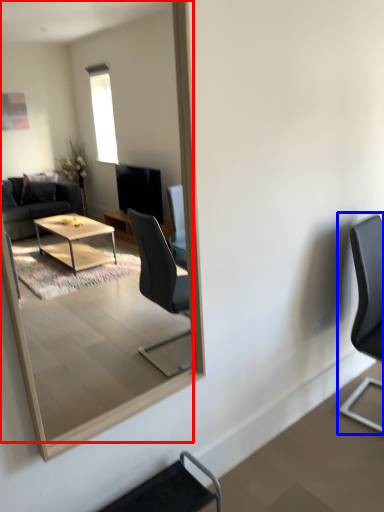
Question: Among these objects, which one is farthest to the camera, mirror (highlighted by a red box) or chair (highlighted by a blue box)?

Choices:
 (A) mirror
 (B) chair

Answer: (B)